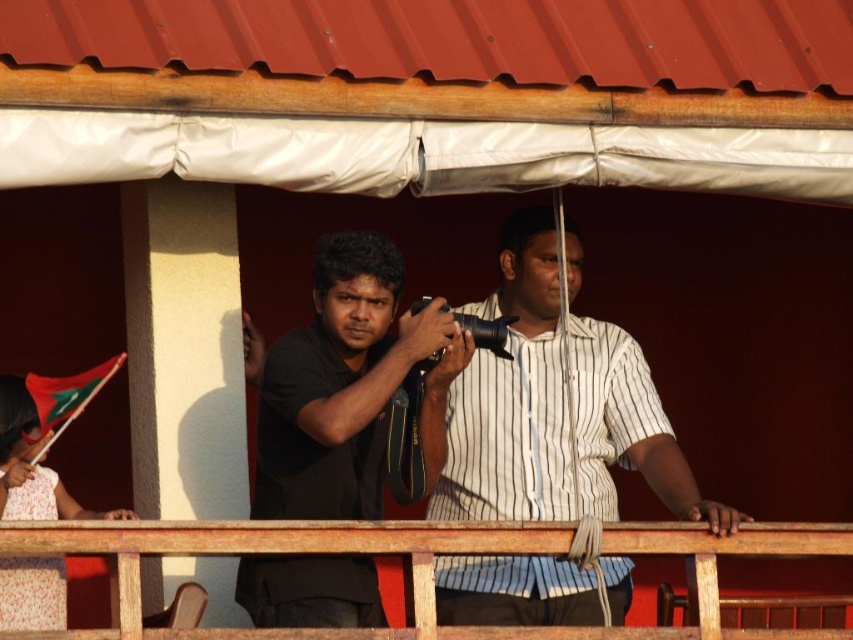
Between white striped shirt at center and wooden at center, which one has more height?

With more height is white striped shirt at center.

Image resolution: width=853 pixels, height=640 pixels. Identify the location of white striped shirt at center. (556, 408).

Which is in front, point (347, 250) or point (51, 541)?

Point (51, 541)

Can you confirm if black matte camera at center is taller than wooden at center?

Yes.

Does point (270, 454) come in front of point (64, 528)?

No, (270, 454) is behind (64, 528).

What are the coordinates of `black matte camera at center` in the screenshot? It's located at (344, 385).

Between white striped shirt at center and black matte camera at center, which one is positioned higher?

Positioned higher is black matte camera at center.

In the scene shown: Can you confirm if white striped shirt at center is positioned to the right of black matte camera at center?

Indeed, white striped shirt at center is positioned on the right side of black matte camera at center.

The image size is (853, 640). I want to click on white striped shirt at center, so click(556, 408).

Identify the location of white striped shirt at center. Image resolution: width=853 pixels, height=640 pixels. (556, 408).